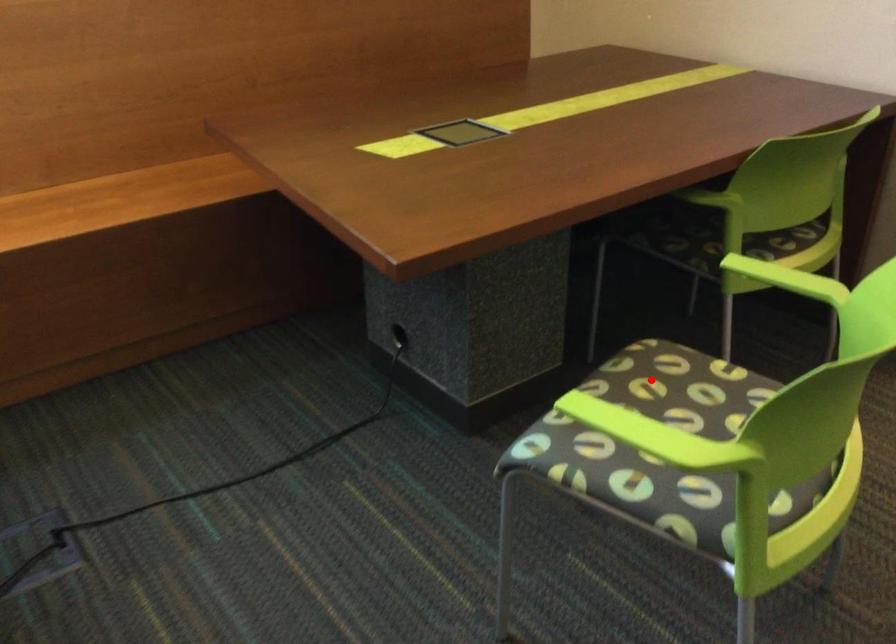
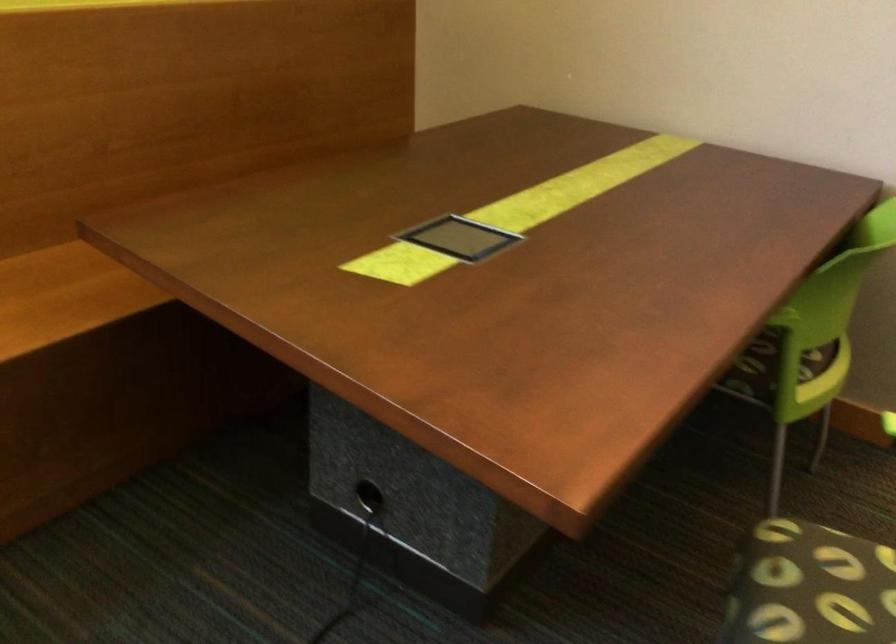
Question: A red point is marked in image1. In image2, is the corresponding 3D point closer to the camera or farther? Reply with the corresponding letter.

Choices:
 (A) The corresponding 3D point is closer.
 (B) The corresponding 3D point is farther.

Answer: (A)